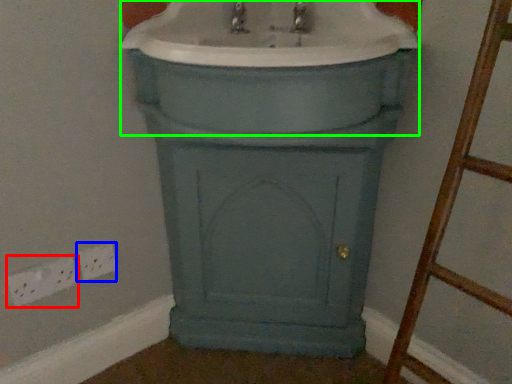
Question: Considering the real-world distances, which object is farthest from electric outlet (highlighted by a red box)? electric outlet (highlighted by a blue box) or sink (highlighted by a green box)?

Choices:
 (A) electric outlet
 (B) sink

Answer: (B)